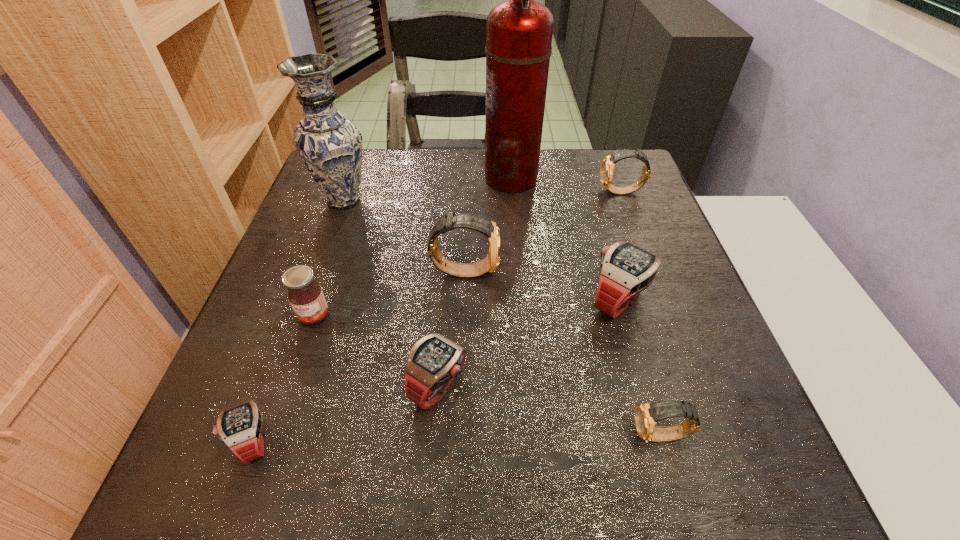
Locate an element on the screen. the tallest object is located at coordinates (519, 31).

Identify the location of red fire extinguisher. (519, 31).

At what (x,y) coordinates should I click in order to perform the action: click on the eighth shortest object. Please return your answer as a coordinate pair (x, y). The height and width of the screenshot is (540, 960). Looking at the image, I should click on (330, 146).

Find the location of a particular element. blue vase is located at coordinates (330, 146).

Where is `the leftmost gold watch`? The height and width of the screenshot is (540, 960). the leftmost gold watch is located at coordinates (479, 223).

Locate an element on the screen. the seventh shortest object is located at coordinates pyautogui.click(x=479, y=223).

You are a GUI agent. You are given a task and a screenshot of the screen. Output one action in this format:
    pyautogui.click(x=<x>, y=<y>)
    Task: Click on the farthest red watch
    Image resolution: width=960 pixels, height=540 pixels.
    Given the screenshot: What is the action you would take?
    pyautogui.click(x=626, y=269)

I want to click on the rightmost red watch, so click(x=626, y=269).

This screenshot has height=540, width=960. In order to click on the second smallest gold watch in this screenshot , I will do `click(606, 171)`.

Find the location of a particular element. the farthest gold watch is located at coordinates [606, 171].